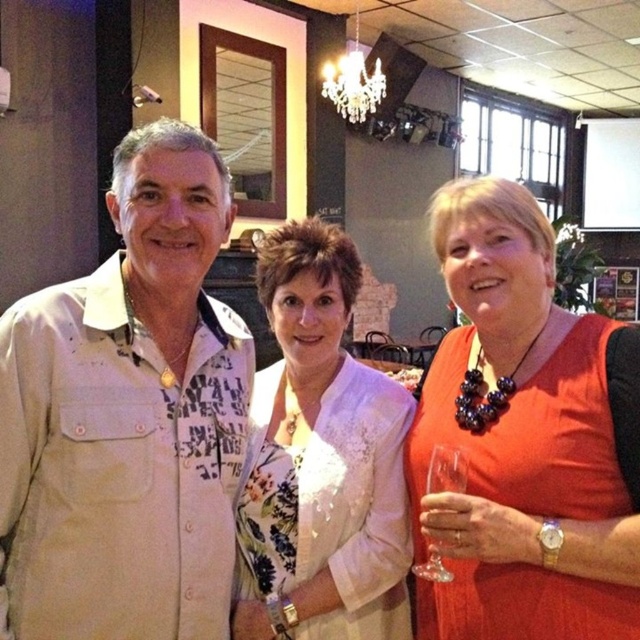
Which is below, white floral blouse at center or clear glass wine glass at lower right?

clear glass wine glass at lower right

How much distance is there between white floral blouse at center and clear glass wine glass at lower right?

The distance of white floral blouse at center from clear glass wine glass at lower right is 10.86 inches.

Does point (330, 634) come farther from viewer compared to point (444, 486)?

That is True.

This screenshot has width=640, height=640. Identify the location of white floral blouse at center. (321, 460).

Is beige cotton shirt at center taller than orange fabric dress at center?

No, beige cotton shirt at center is not taller than orange fabric dress at center.

You are a GUI agent. You are given a task and a screenshot of the screen. Output one action in this format:
    pyautogui.click(x=<x>, y=<y>)
    Task: Click on the beige cotton shirt at center
    
    Given the screenshot: What is the action you would take?
    pyautogui.click(x=128, y=417)

Between point (134, 156) and point (445, 216), which one is positioned in front?

Point (134, 156)

At what (x,y) coordinates should I click in order to perform the action: click on beige cotton shirt at center. Please return your answer as a coordinate pair (x, y). Looking at the image, I should click on (128, 417).

Does beige cotton shirt at center come in front of white floral blouse at center?

Yes.

How far apart are beige cotton shirt at center and white floral blouse at center?

beige cotton shirt at center and white floral blouse at center are 10.07 inches apart.

Measure the distance between point (144, 228) and camera.

Point (144, 228) and camera are 1.05 meters apart.

Where is `beige cotton shirt at center`? This screenshot has height=640, width=640. beige cotton shirt at center is located at coordinates (128, 417).